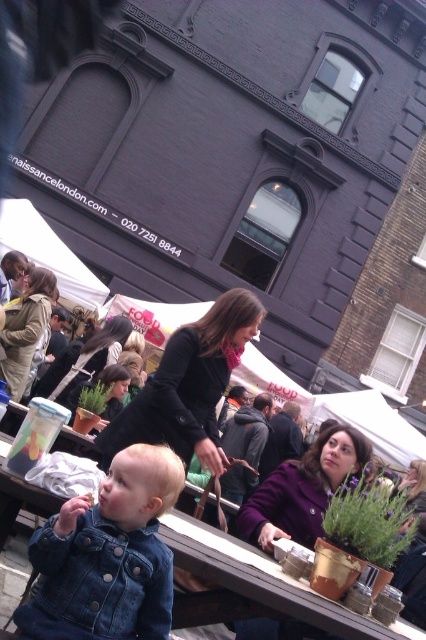
Question: In this image, where is faded denim jacket at lower right located relative to black matte jacket at center?

Choices:
 (A) above
 (B) below

Answer: (B)

Question: Does faded denim jacket at lower right have a smaller size compared to matte black jacket at center?

Choices:
 (A) yes
 (B) no

Answer: (A)

Question: Which point appears closest to the camera in this image?

Choices:
 (A) (83, 352)
 (B) (25, 310)
 (C) (57, 576)

Answer: (C)

Question: Based on their relative distances, which object is nearer to the faded denim jacket at lower right?

Choices:
 (A) black matte jacket at center
 (B) matte black jacket at center
 (C) purple woolen coat at center

Answer: (C)

Question: Does faded denim jacket at lower right have a smaller size compared to matte black jacket at center?

Choices:
 (A) no
 (B) yes

Answer: (B)

Question: Which object is the closest to the faded denim jacket at lower right?

Choices:
 (A) purple woolen coat at center
 (B) tan leather jacket at center
 (C) matte black jacket at center

Answer: (A)